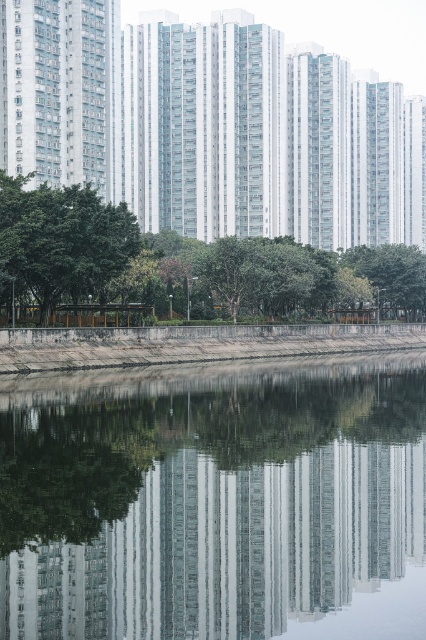
You are standing at the edge of the urban landscape and want to take a photo of both the transparent glass water at center and the green leafy tree at lower left. Which object should you focus on first to ensure both are in the frame?

You should focus on the transparent glass water at center first because it is in front of the green leafy tree at lower left, so positioning the camera to include the water will naturally include the tree in the background.

You are a drone operator flying a drone that is 1 meter tall. You want to fly your drone from the green leafy tree at center to the dull concrete wall at lower center. Can your drone safely pass between them without hitting either?

The green leafy tree at center is further to the viewer than the dull concrete wall at lower center, so the distance between them is sufficient for the drone to pass safely as long as it maintains a straight path between them.